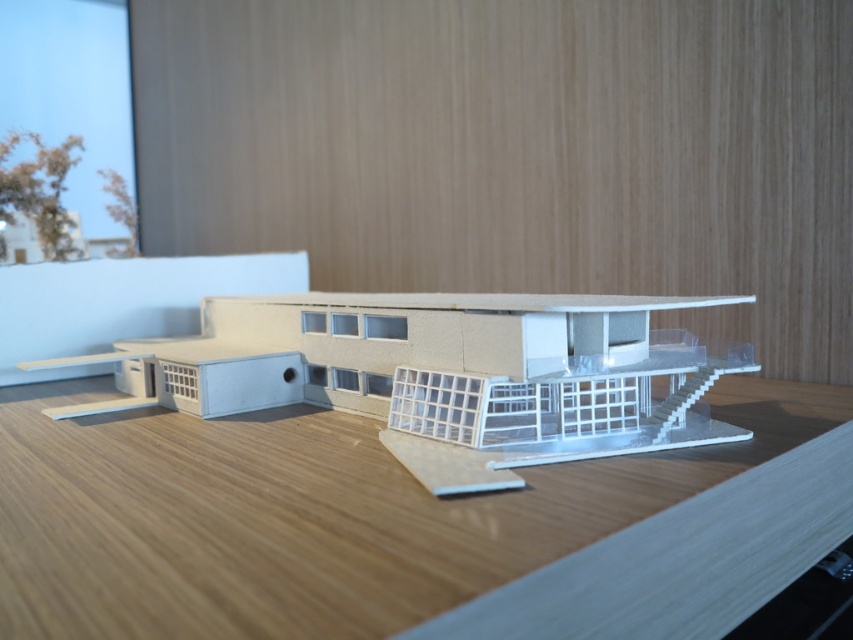
Is wooden table at center above white matte building at center?

No.

Between point (289, 545) and point (714, 420), which one is positioned in front?

Point (289, 545)

Image resolution: width=853 pixels, height=640 pixels. I want to click on wooden table at center, so click(x=401, y=525).